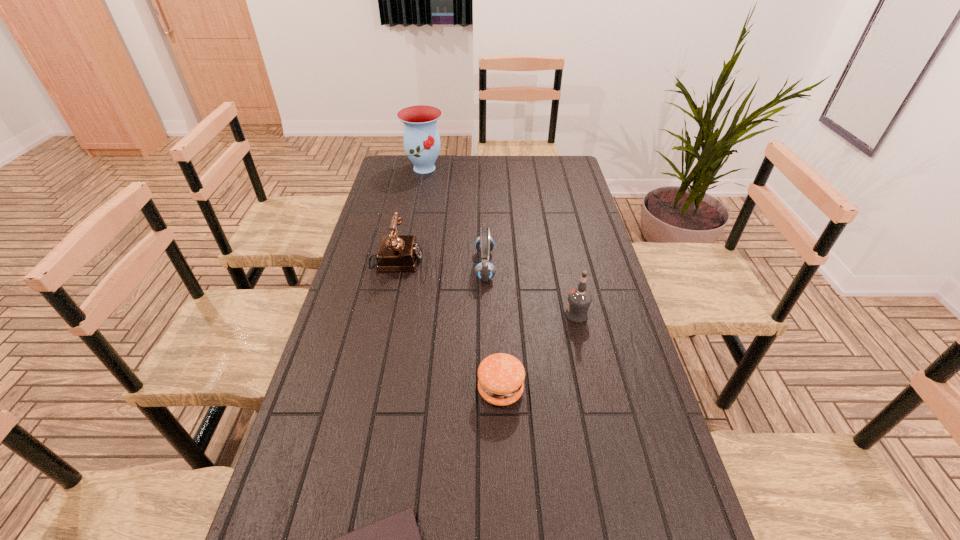
Where is `vase`? vase is located at coordinates (421, 139).

This screenshot has height=540, width=960. What are the coordinates of `the tallest object` in the screenshot? It's located at (421, 139).

The width and height of the screenshot is (960, 540). In order to click on vodka in this screenshot , I will do `click(579, 299)`.

This screenshot has width=960, height=540. What are the coordinates of `the third nearest object` in the screenshot? It's located at (579, 299).

Identify the location of telephone. This screenshot has width=960, height=540. click(401, 253).

Find the location of `headset`. headset is located at coordinates (485, 271).

You are a GUI agent. You are given a task and a screenshot of the screen. Output one action in this format:
    pyautogui.click(x=<x>, y=<y>)
    Task: Click on the fifth farthest object
    The height and width of the screenshot is (540, 960).
    Given the screenshot: What is the action you would take?
    click(x=501, y=376)

Where is `patty`? The width and height of the screenshot is (960, 540). patty is located at coordinates (501, 376).

The height and width of the screenshot is (540, 960). I want to click on vacant space situated on the right of the vase, so 522,168.

This screenshot has height=540, width=960. I want to click on free space located 0.160m on the front label of the vodka, so click(512, 315).